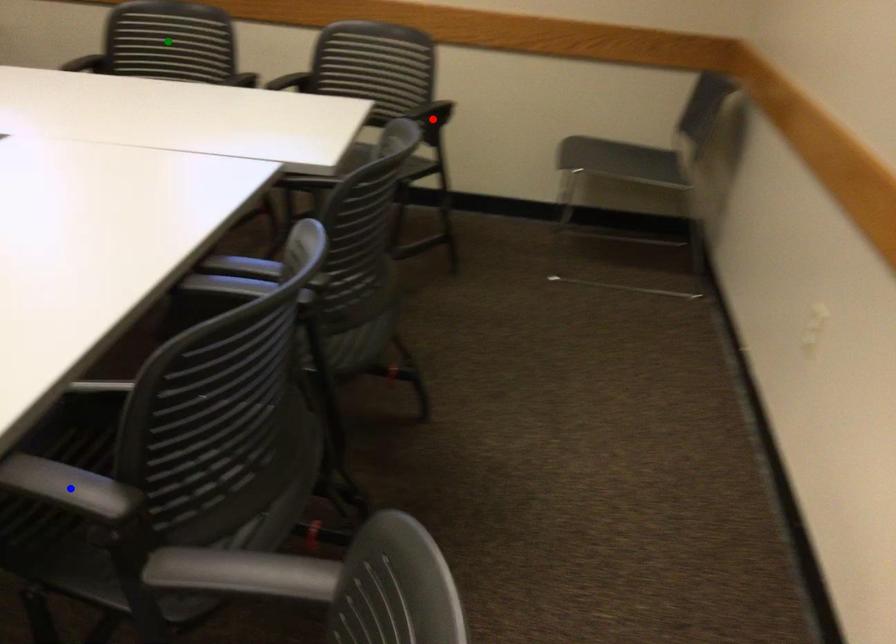
Order these from farthest to nearest:
- red point
- blue point
- green point

green point < red point < blue point